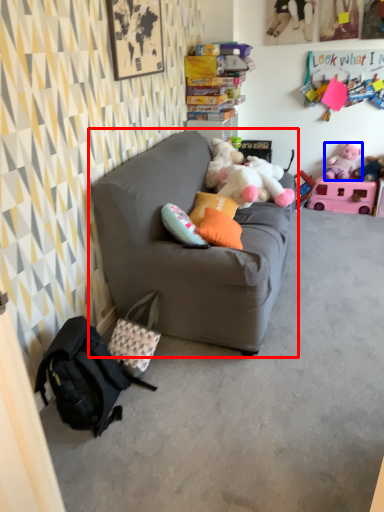
Question: Which of the following is the farthest to the observer, studio couch (highlighted by a red box) or toy (highlighted by a blue box)?

Choices:
 (A) studio couch
 (B) toy

Answer: (B)